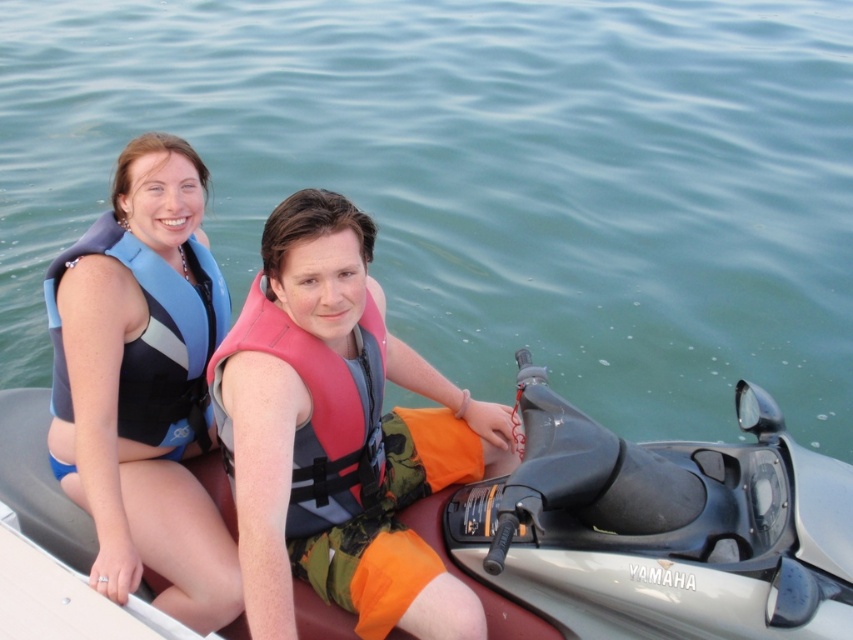
Based on the photo, you are a photographer standing on the dock and want to capture a photo of the clear blue water at upper center and the blue fabric life jacket at left. The camera you are using has a minimum focusing distance of 10 feet. Will you be able to take the photo without moving closer?

The distance between the clear blue water at upper center and the blue fabric life jacket at left is 11.73 feet, which is greater than the camera minimum focusing distance of 10 feet. Therefore, you can take the photo without moving closer.

You are a photographer trying to capture a photo of the clear blue water at upper center and the blue fabric life jacket at left. Based on their positions, which object is closer to the right side of the image?

The clear blue water at upper center is to the right of the blue fabric life jacket at left, so the clear blue water at upper center is closer to the right side of the image.

You are a safety inspector checking the jet ski for proper life vest placement. According to the safety guidelines, life vests must be visible and not obscured by other items. Are both the blue neoprene life vest at upper left and the pink fabric life jacket at center properly visible?

The blue neoprene life vest at upper left is positioned over the pink fabric life jacket at center, which means the pink fabric life jacket at center is at least partially obscured. Therefore, the pink fabric life jacket at center is not properly visible, violating the safety guidelines.